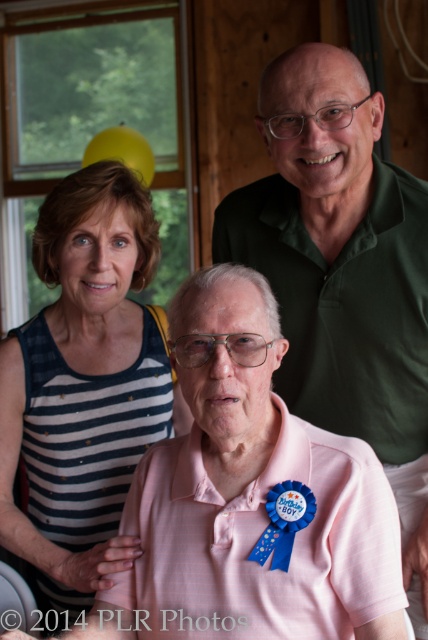
You are a photographer standing at the camera position. You want to take a closeup shot of the green matte shirt at upper center. Considering the distance between you and the shirt, is it possible to capture the shirt in focus without moving closer?

The distance between the green matte shirt at upper center and the camera is 3.86 feet. This distance allows for a clear focus on the shirt without needing to move closer, as modern cameras can effectively focus at this range.

Consider the image. You are taking a photo of the birthday boy and his friends. You notice two points in the image labeled as point (353, 100) and point (59, 228). Which point is closer to the camera?

Point (353, 100) is closer to the camera than point (59, 228).

You are a photographer adjusting your camera to focus on the green matte shirt at upper center and the striped fabric dress at upper left. Which of these two items is closer to your camera lens?

The green matte shirt at upper center is closer to the camera lens because it is further to the viewer than the striped fabric dress at upper left.